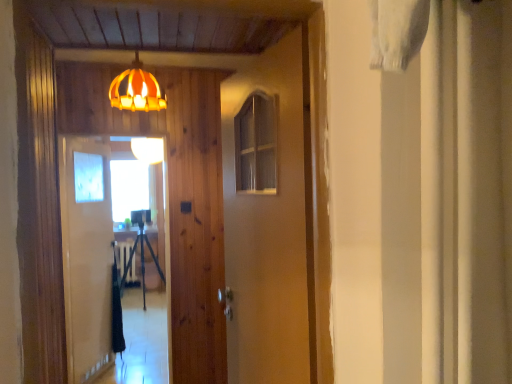
Locate an element on the screen. vacant space in matte orange lampshade at upper center, placed as the second lamp when sorted from front to back (from a real-world perspective) is located at coordinates (148, 324).